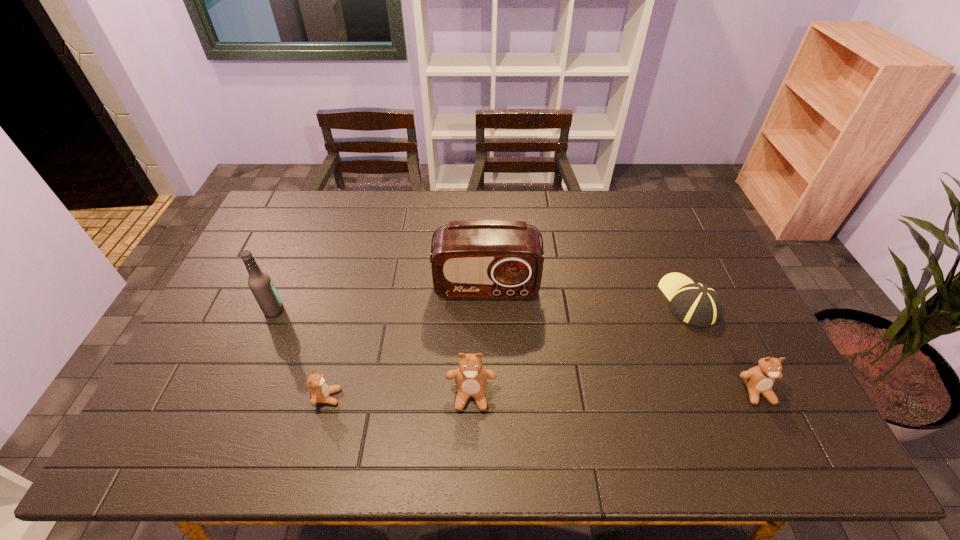
Locate an element on the screen. vacant space positioned 0.180m on the side of the leftmost object with the label is located at coordinates (346, 310).

This screenshot has width=960, height=540. In order to click on vacant space situated on the front panel of the radio receiver in this screenshot , I will do `click(487, 340)`.

Identify the location of vacant space located with the brim of the shortest object facing forward. Image resolution: width=960 pixels, height=540 pixels. (648, 208).

I want to click on vacant region located 0.050m with the brim of the shortest object facing forward, so click(x=673, y=265).

The width and height of the screenshot is (960, 540). I want to click on vacant space located 0.360m with the brim of the shortest object facing forward, so click(x=647, y=207).

At what (x,y) coordinates should I click in order to perform the action: click on object situated at the left edge. Please return your answer as a coordinate pair (x, y). The height and width of the screenshot is (540, 960). Looking at the image, I should click on (259, 282).

Identify the location of teddy bear that is at the right edge. Image resolution: width=960 pixels, height=540 pixels. (759, 379).

Where is `baseball cap that is at the right edge`? This screenshot has height=540, width=960. baseball cap that is at the right edge is located at coordinates (696, 304).

Find the location of a particular element. object present at the near right corner is located at coordinates (759, 379).

At what (x,y) coordinates should I click in order to perform the action: click on vacant point at the far edge. Please return your answer as a coordinate pair (x, y). Looking at the image, I should click on (x=639, y=206).